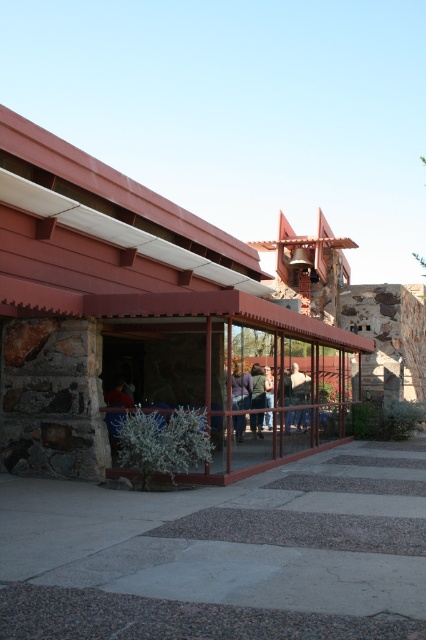
Does brown stone shed at center have a lesser width compared to white fabric shirt at center?

No.

Can you confirm if brown stone shed at center is shorter than white fabric shirt at center?

No, brown stone shed at center is not shorter than white fabric shirt at center.

You are a GUI agent. You are given a task and a screenshot of the screen. Output one action in this format:
    pyautogui.click(x=<x>, y=<y>)
    Task: Click on the brown stone shed at center
    The width and height of the screenshot is (426, 640).
    Given the screenshot: What is the action you would take?
    pyautogui.click(x=140, y=321)

The image size is (426, 640). Find the location of `brown stone shed at center`. brown stone shed at center is located at coordinates (140, 321).

Which is more to the left, brown stone shed at center or matte gray sweater at center?

brown stone shed at center is more to the left.

Is brown stone shed at center above matte gray sweater at center?

Yes, brown stone shed at center is above matte gray sweater at center.

Which is behind, point (34, 145) or point (233, 387)?

The point (233, 387) is behind.

The height and width of the screenshot is (640, 426). In order to click on brown stone shed at center in this screenshot , I will do `click(140, 321)`.

Which is behind, point (235, 408) or point (296, 396)?

Point (296, 396)

Who is more forward, [238,392] or [296,428]?

Point [296,428] is in front.

The width and height of the screenshot is (426, 640). I want to click on light brown leather jacket at center, so click(241, 387).